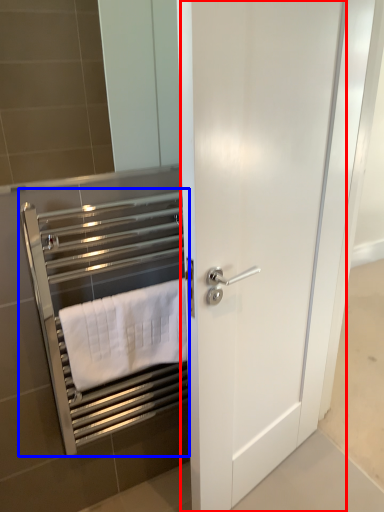
Question: Among these objects, which one is farthest to the camera, door (highlighted by a red box) or closet (highlighted by a blue box)?

Choices:
 (A) door
 (B) closet

Answer: (B)